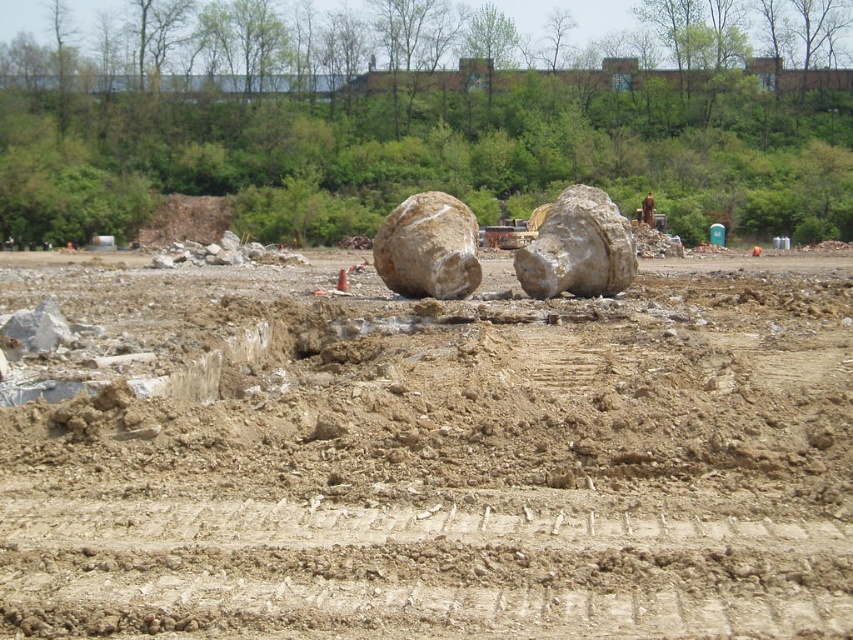
You are a construction worker assessing the site. You notice the brown sandy dirt at center and the smooth gray rock at center. Which object is positioned lower in the scene?

The brown sandy dirt at center is located below the smooth gray rock at center, so it is positioned lower in the scene.

Consider the image. You are a geologist examining the construction site. You notice the smooth gray rock at center and the rough beige boulder at center. Which one has a greater height?

The smooth gray rock at center is much taller than the rough beige boulder at center.